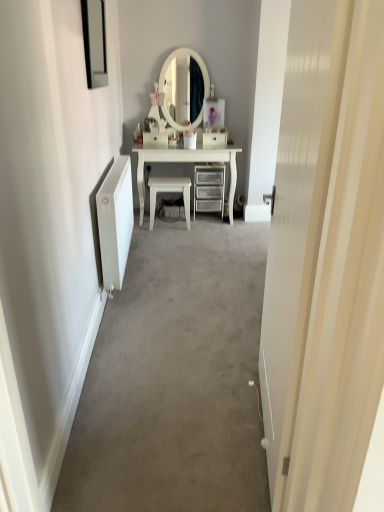
The image size is (384, 512). Identify the location of vacant area situated below white wood door at center (from a real-world perspective). (264, 452).